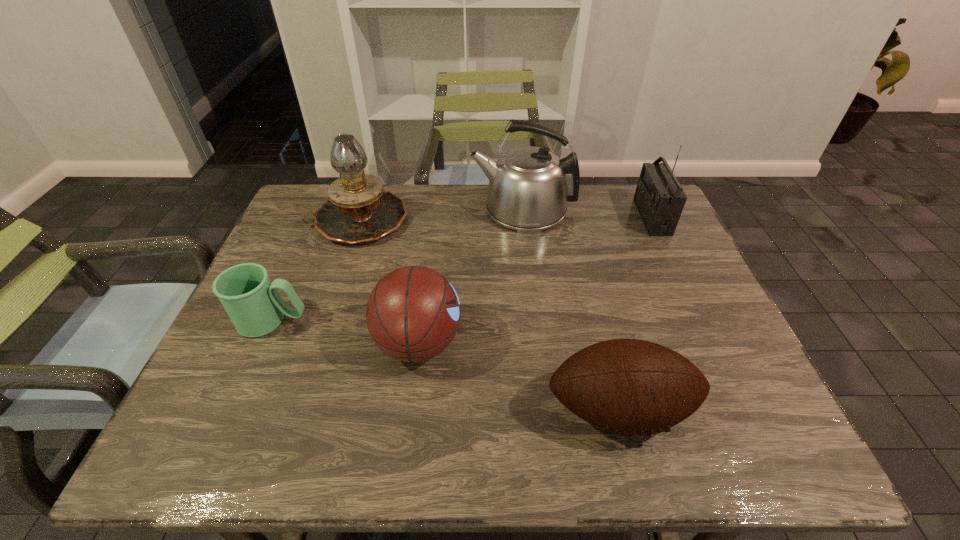
Where is `mug located in the left edge section of the desktop`? mug located in the left edge section of the desktop is located at coordinates (252, 302).

The image size is (960, 540). Find the location of `radio receiver at the right edge`. radio receiver at the right edge is located at coordinates (659, 197).

Identify the location of football at the right edge. (627, 386).

Locate an element on the screen. The height and width of the screenshot is (540, 960). object present at the far left corner is located at coordinates (359, 210).

Find the location of `object located in the far right corner section of the desktop`. object located in the far right corner section of the desktop is located at coordinates (659, 197).

Where is `object that is at the near right corner`? The height and width of the screenshot is (540, 960). object that is at the near right corner is located at coordinates (627, 386).

Find the location of a particular element. This screenshot has height=540, width=960. vacant point at the near edge is located at coordinates (423, 461).

The width and height of the screenshot is (960, 540). I want to click on free space at the left edge of the desktop, so click(314, 282).

This screenshot has width=960, height=540. I want to click on vacant space at the right edge of the desktop, so click(715, 313).

Identify the location of vacant region at the near right corner of the desktop. (696, 426).